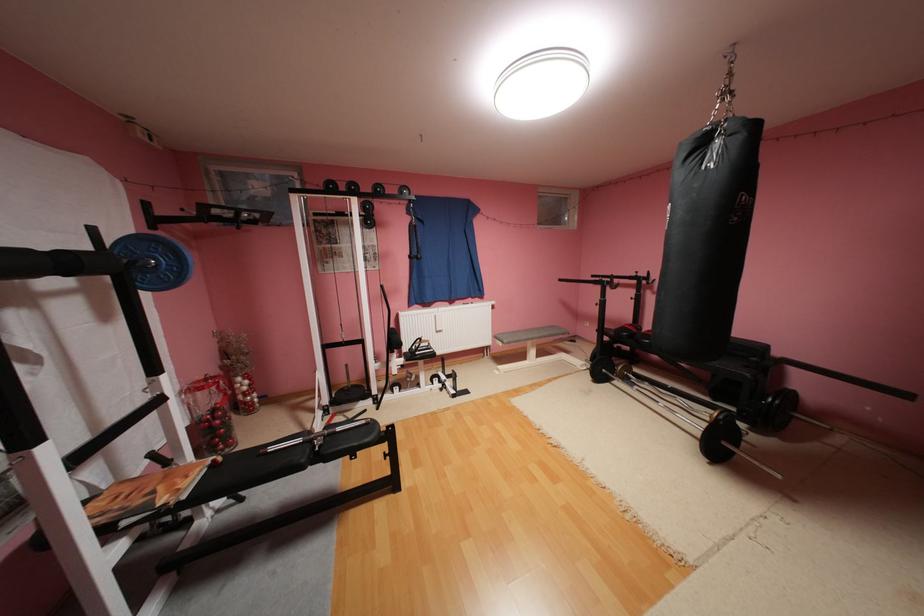
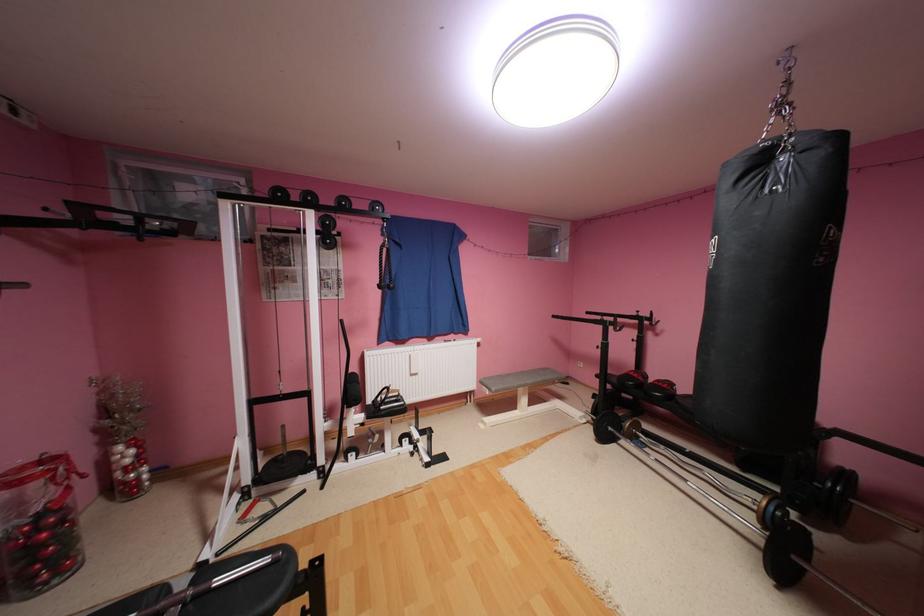
Where in the second image is the point corresponding to pixel 711 142 from the first image?

(769, 161)